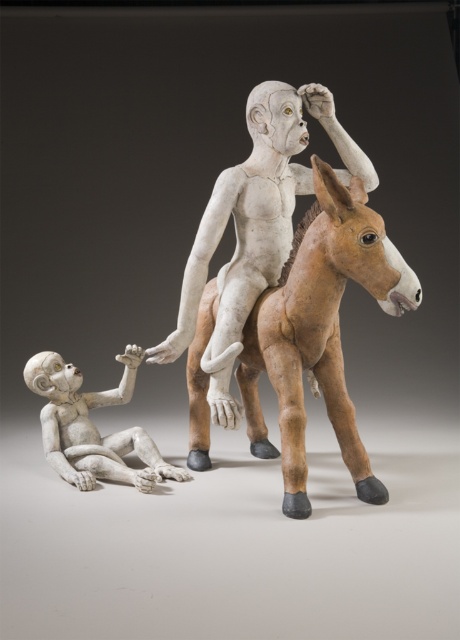
You are an art critic analyzing the sculpture. You notice the brown matte horse at center and the white matte figure at center. Which one has a smaller height?

The brown matte horse at center has a lesser height compared to the white matte figure at center.

You are an art curator planning to display the brown matte horse at center and the white matte figure at center in a gallery. Considering their sizes, which object should be placed on a higher pedestal to ensure both are visible from the front without obstruction?

The brown matte horse at center is larger than the white matte figure at center, so placing the smaller white matte figure at center on a higher pedestal will ensure both are visible from the front without obstruction.

You are an art critic observing the sculpture. You notice the brown matte horse at center and the matte white figure at lower left. Which of these two objects is positioned closer to your viewpoint?

The brown matte horse at center is closer to the viewer than the matte white figure at lower left.